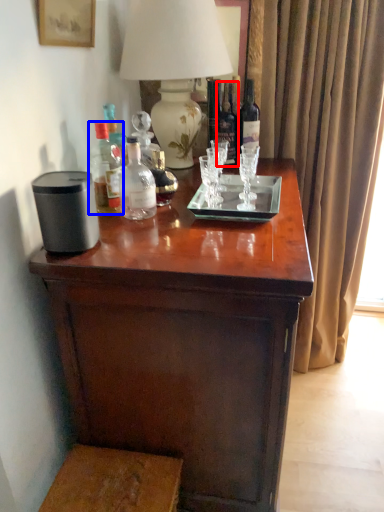
Question: Which point is further to the camera, bottle (highlighted by a red box) or bottle (highlighted by a blue box)?

Choices:
 (A) bottle
 (B) bottle

Answer: (A)